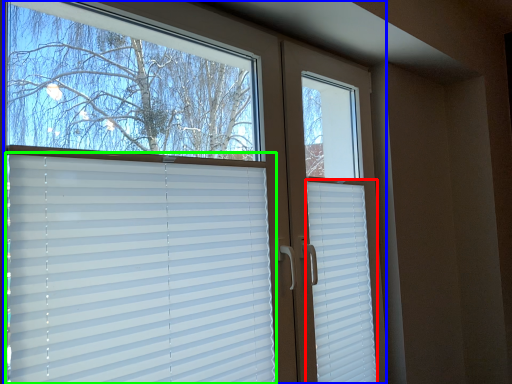
Question: Which is nearer to the shutter (highlighted by a red box)? window (highlighted by a blue box) or window blind (highlighted by a green box).

Choices:
 (A) window
 (B) window blind

Answer: (A)